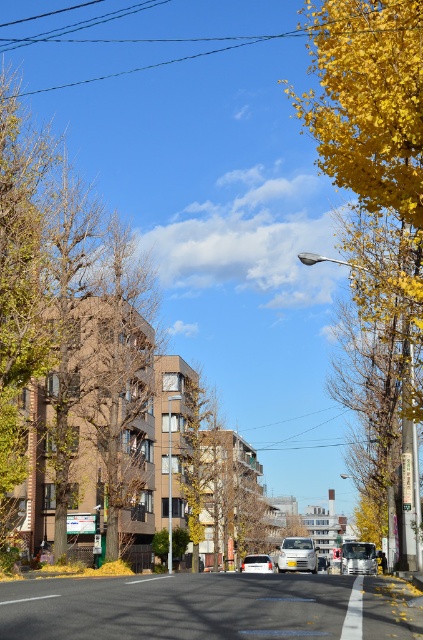
Question: Which point is farther to the camera?

Choices:
 (A) metallic silver van at center
 (B) matte silver van at center
 (C) white glossy car at center
 (D) brown textured tree at center

Answer: (C)

Question: Which point is closer to the camera?

Choices:
 (A) (378, 42)
 (B) (365, 548)

Answer: (A)

Question: Can you confirm if brown textured tree at center is positioned above metallic silver van at center?

Choices:
 (A) yes
 (B) no

Answer: (A)

Question: Can you confirm if yellow leafy tree at right is bigger than metallic silver van at center?

Choices:
 (A) no
 (B) yes

Answer: (B)

Question: Which point appears closest to the camera in this image?

Choices:
 (A) tap(346, 545)
 (B) tap(247, 566)
 (C) tap(143, 307)

Answer: (C)

Question: Does yellow leafy tree at right appear over brown textured tree at center?

Choices:
 (A) no
 (B) yes

Answer: (B)